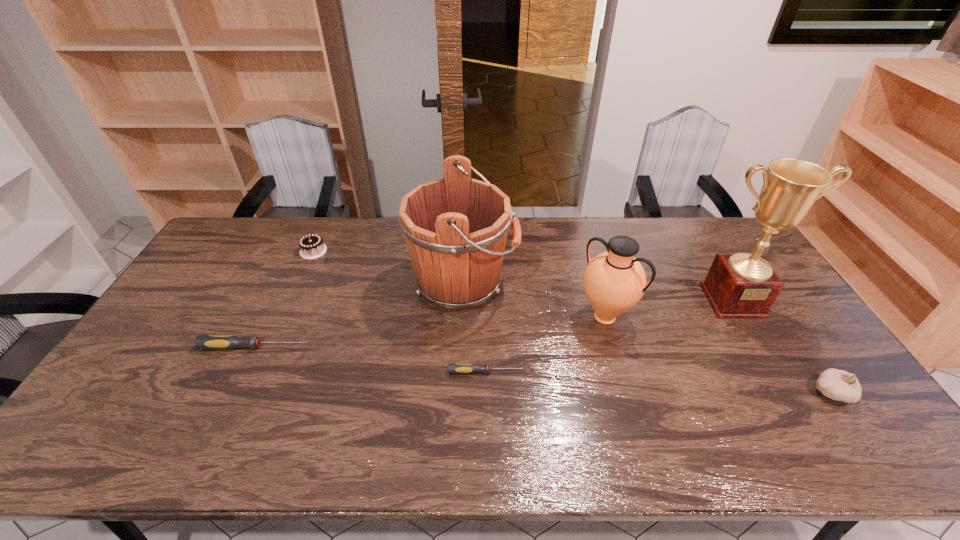
Please point a spot to add another screwdriver on the right. Please provide its 2D coordinates. Your answer should be formatted as a tuple, i.e. [(x, y)], where the tuple contains the x and y coordinates of a point satisfying the conditions above.

[(743, 399)]